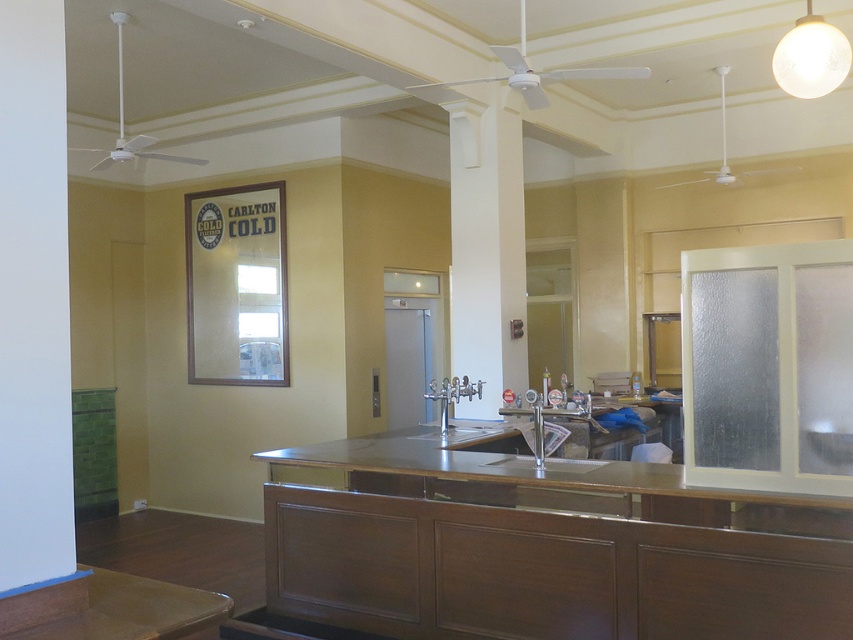
Question: Which of the following is the closest to the observer?

Choices:
 (A) stainless steel counter at center
 (B) satin nickel faucet at center
 (C) silver metallic faucet at center

Answer: (A)

Question: Can you confirm if silver metallic faucet at center is thinner than satin nickel faucet at center?

Choices:
 (A) yes
 (B) no

Answer: (B)

Question: Does silver metallic faucet at center come in front of satin nickel faucet at center?

Choices:
 (A) yes
 (B) no

Answer: (B)

Question: Is stainless steel counter at center above silver metallic faucet at center?

Choices:
 (A) no
 (B) yes

Answer: (A)

Question: Which point appears farthest from the camera in this image?

Choices:
 (A) (300, 461)
 (B) (456, 401)
 (C) (537, 412)

Answer: (B)

Question: Estimate the real-world distances between objects in this image. Which object is closer to the stainless steel counter at center?

Choices:
 (A) silver metallic faucet at center
 (B) satin nickel faucet at center

Answer: (B)